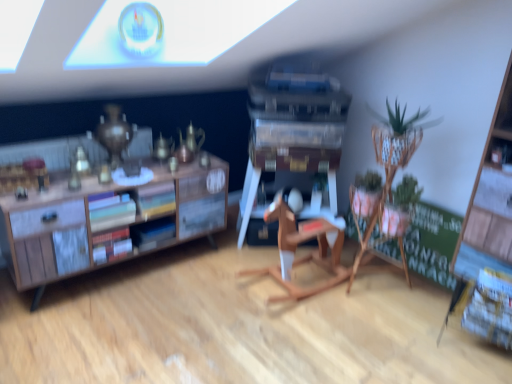
Locate an element on the screen. The width and height of the screenshot is (512, 384). free spot to the right of wooden rocking horse at center is located at coordinates (392, 318).